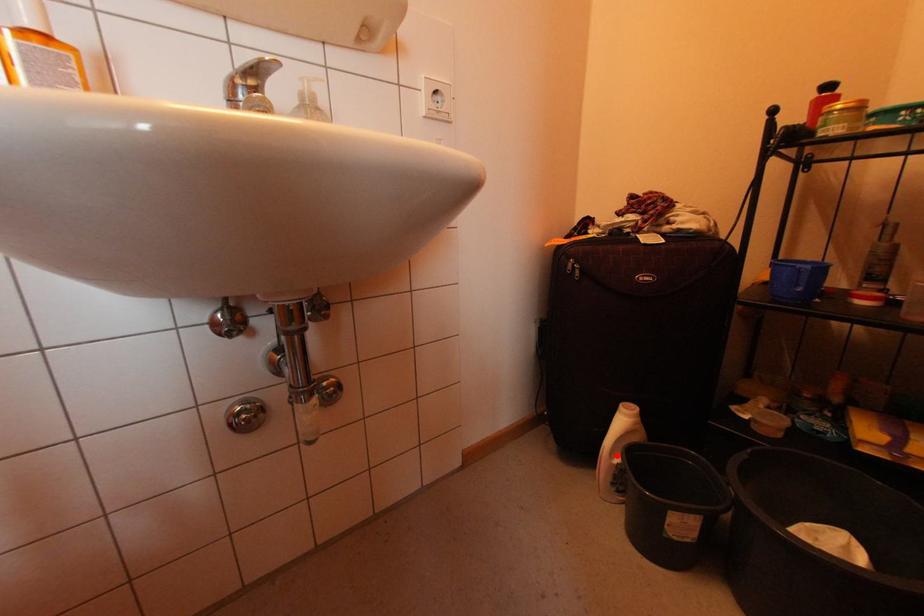
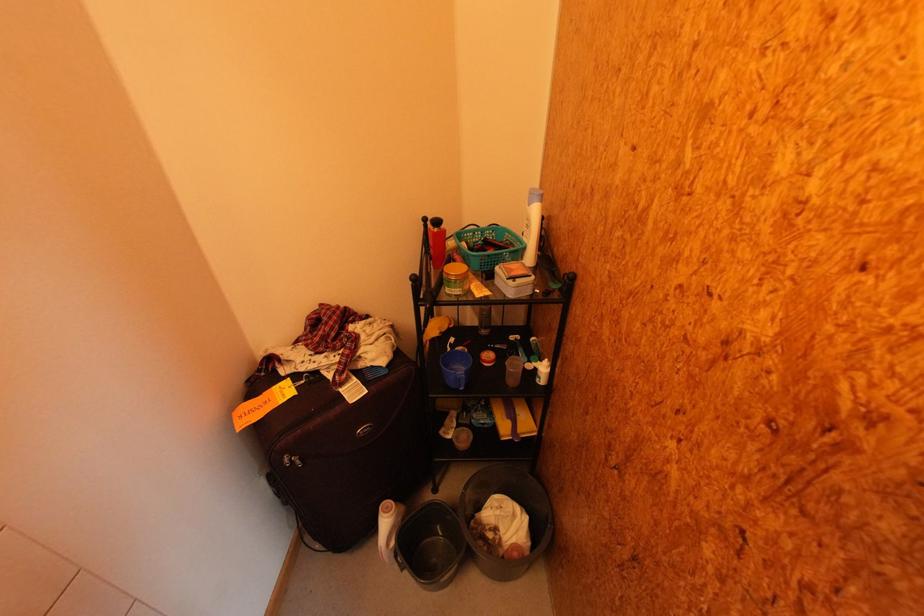
Question: I am providing you with two images of the same scene from different viewpoints. Given a red point in image1, look at the same physical point in image2. Is it:

Choices:
 (A) Closer to the viewpoint
 (B) Farther from the viewpoint

Answer: (B)